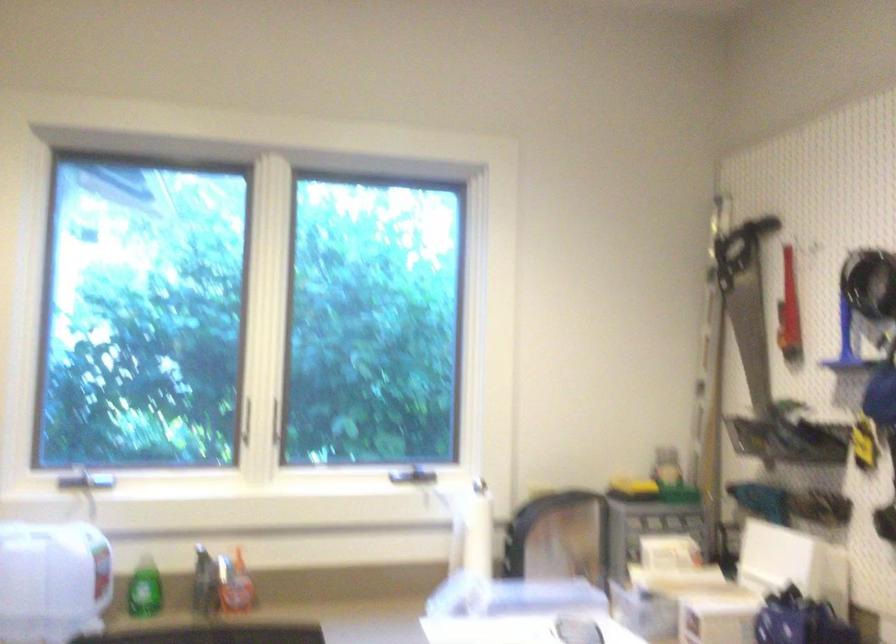
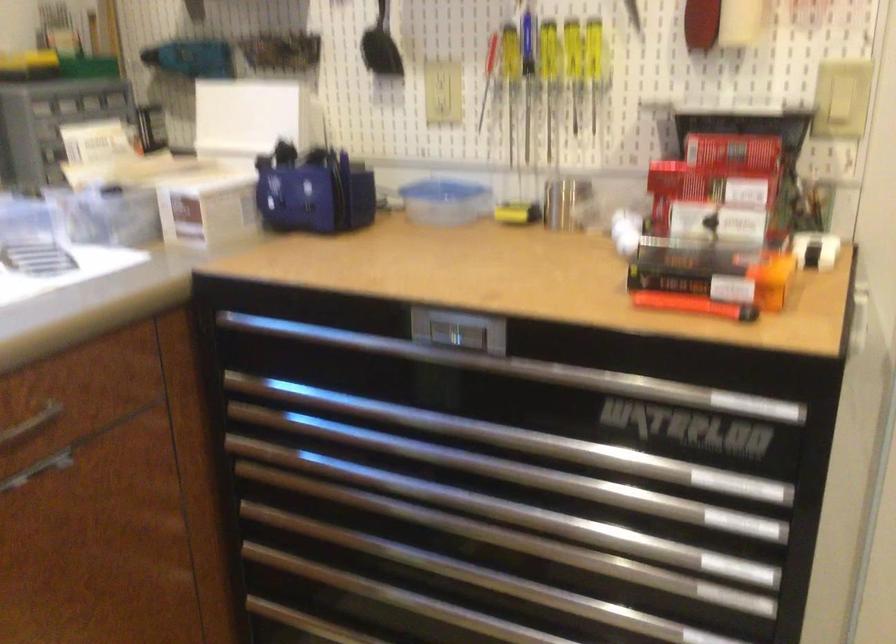
The first image is from the beginning of the video and the second image is from the end. How did the camera likely rotate when shooting the video?

The rotation direction of the camera is right-down.